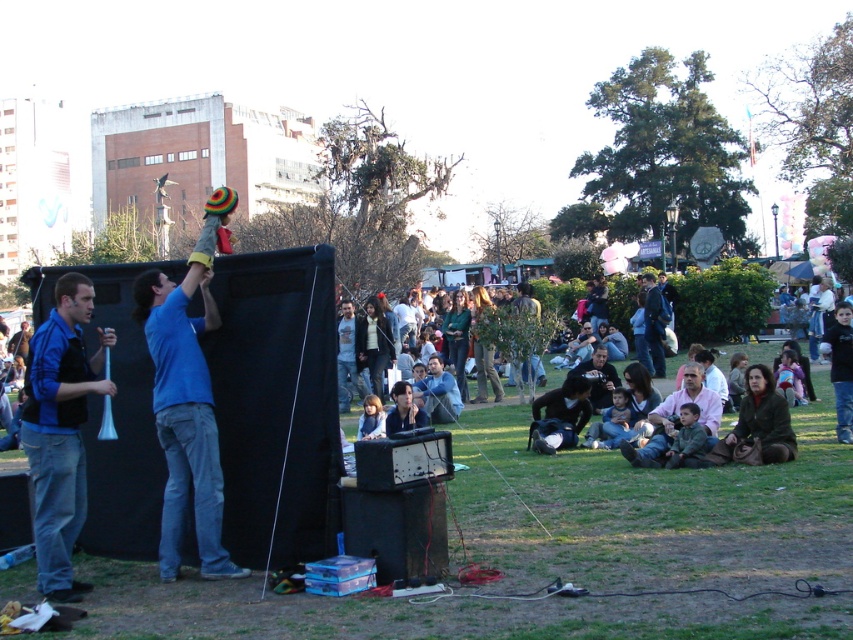
Question: Is blue fabric hat at upper left in front of dark brown leather jacket at center?

Choices:
 (A) no
 (B) yes

Answer: (B)

Question: Which of the following is the closest to the observer?

Choices:
 (A) blue fabric hat at upper left
 (B) blue fabric megaphone at left

Answer: (B)

Question: Is blue fabric megaphone at left above dark brown leather jacket at center?

Choices:
 (A) yes
 (B) no

Answer: (B)

Question: Which point is farther to the camera?

Choices:
 (A) dark brown leather jacket at center
 (B) blue fabric megaphone at left
 (C) blue fabric hat at upper left

Answer: (A)

Question: Which object appears closest to the camera in this image?

Choices:
 (A) blue fabric hat at upper left
 (B) blue fabric megaphone at left
 (C) dark brown leather jacket at center

Answer: (B)

Question: Can you confirm if blue fabric hat at upper left is positioned above dark brown leather jacket at center?

Choices:
 (A) no
 (B) yes

Answer: (A)